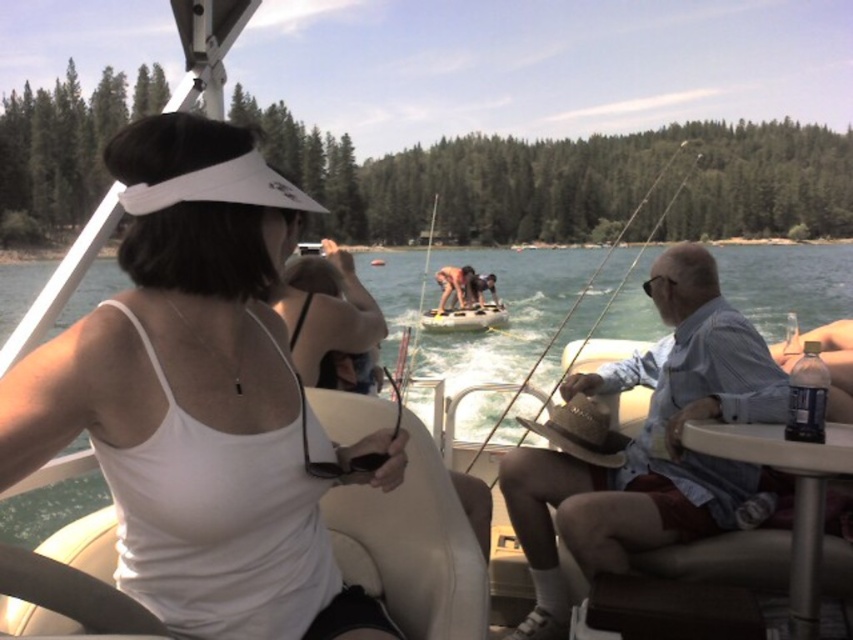
Question: Which point is closer to the camera?

Choices:
 (A) rubber dinghy at center
 (B) light blue denim shirt at right

Answer: (B)

Question: Based on their relative distances, which object is nearer to the light blue denim shirt at right?

Choices:
 (A) rubber dinghy at center
 (B) white matte visor at upper left

Answer: (B)

Question: Among these objects, which one is farthest from the camera?

Choices:
 (A) rubber dinghy at center
 (B) white matte visor at upper left
 (C) light blue denim shirt at right

Answer: (A)

Question: Is light blue denim shirt at right to the left of rubber dinghy at center from the viewer's perspective?

Choices:
 (A) no
 (B) yes

Answer: (B)

Question: Does white matte visor at upper left lie behind rubber dinghy at center?

Choices:
 (A) no
 (B) yes

Answer: (A)

Question: Is white matte visor at upper left to the right of light blue denim shirt at right from the viewer's perspective?

Choices:
 (A) no
 (B) yes

Answer: (A)